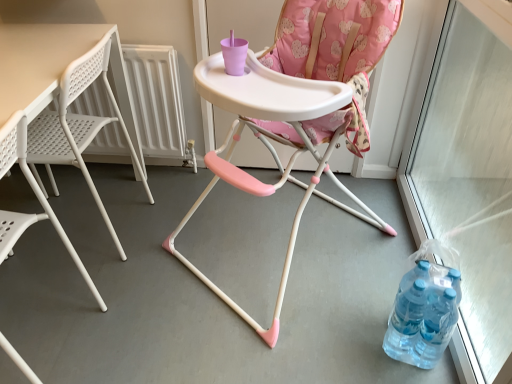
Question: From a real-world perspective, is white plastic chair at left, which appears as the first chair when viewed from the left, on top of white plastic radiator at left?

Choices:
 (A) no
 (B) yes

Answer: (B)

Question: Could you tell me if white plastic chair at left, the second chair when ordered from right to left, is turned towards white plastic radiator at left?

Choices:
 (A) yes
 (B) no

Answer: (B)

Question: Does white plastic chair at left, the second chair when ordered from right to left, contain white plastic radiator at left?

Choices:
 (A) yes
 (B) no

Answer: (B)

Question: Is white plastic chair at left, the second chair when ordered from right to left, wider than white plastic radiator at left?

Choices:
 (A) yes
 (B) no

Answer: (A)

Question: From the image's perspective, is white plastic chair at left, the second chair when ordered from right to left, under white plastic radiator at left?

Choices:
 (A) yes
 (B) no

Answer: (A)

Question: Is white plastic radiator at left at the back of white plastic chair at left, the second chair when ordered from right to left?

Choices:
 (A) no
 (B) yes

Answer: (A)

Question: From the image's perspective, is white plastic table at left beneath pink plastic highchair at center, positioned as the 1th chair in right-to-left order?

Choices:
 (A) no
 (B) yes

Answer: (B)

Question: Is white plastic table at left positioned behind pink plastic highchair at center, the 2th chair from the left?

Choices:
 (A) no
 (B) yes

Answer: (B)

Question: Can pink plastic highchair at center, the 2th chair from the left, be found inside white plastic table at left?

Choices:
 (A) yes
 (B) no

Answer: (B)

Question: Is white plastic table at left positioned with its back to pink plastic highchair at center, positioned as the 1th chair in right-to-left order?

Choices:
 (A) no
 (B) yes

Answer: (B)

Question: From a real-world perspective, is white plastic table at left physically below pink plastic highchair at center, positioned as the 1th chair in right-to-left order?

Choices:
 (A) no
 (B) yes

Answer: (B)

Question: Considering the relative sizes of white plastic table at left and pink plastic highchair at center, positioned as the 1th chair in right-to-left order, in the image provided, is white plastic table at left wider than pink plastic highchair at center, positioned as the 1th chair in right-to-left order,?

Choices:
 (A) no
 (B) yes

Answer: (A)

Question: Is white plastic table at left to the right of white plastic chair at left, the second chair when ordered from right to left, from the viewer's perspective?

Choices:
 (A) no
 (B) yes

Answer: (B)